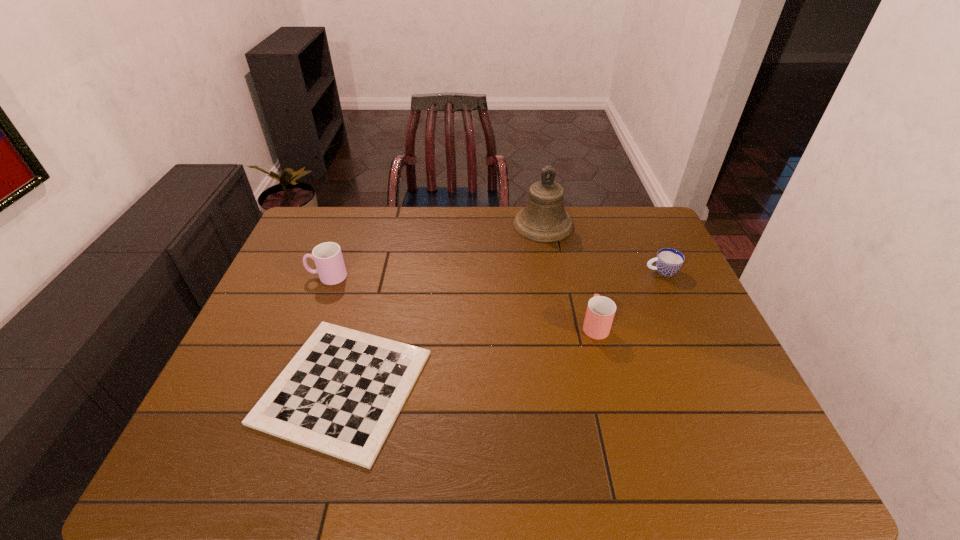
I want to click on vacant space that's between the tallest object and the checkerboard, so click(x=444, y=306).

Where is `empty space between the farthest object and the rightmost object`? This screenshot has height=540, width=960. empty space between the farthest object and the rightmost object is located at coordinates (603, 248).

Find the location of a particular element. Image resolution: width=960 pixels, height=540 pixels. free space between the leftmost cup and the rightmost object is located at coordinates (494, 274).

This screenshot has width=960, height=540. I want to click on vacant area that lies between the leftmost cup and the second cup from right to left, so click(x=461, y=301).

Locate an element on the screen. vacant area that lies between the shortest object and the shortest cup is located at coordinates (502, 329).

Identify the location of free spot between the second shortest object and the nearest cup. (628, 298).

Find the location of a particular element. The image size is (960, 540). empty location between the shortest object and the second cup from left to right is located at coordinates (469, 356).

Image resolution: width=960 pixels, height=540 pixels. Find the location of `the closest object relative to the second shortest object`. the closest object relative to the second shortest object is located at coordinates (600, 312).

This screenshot has width=960, height=540. I want to click on object that is the fourth closest to the second cup from left to right, so click(x=327, y=256).

Identify the location of cup that is the closest to the leftmost cup. This screenshot has height=540, width=960. (600, 312).